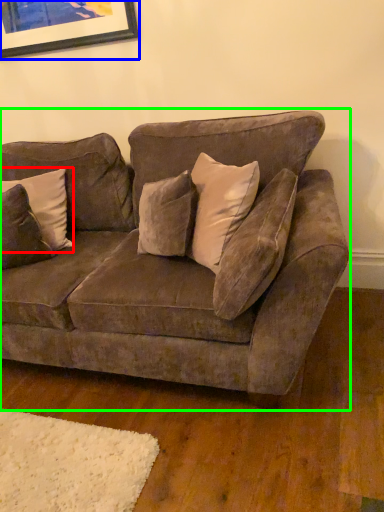
Question: Which object is the farthest from pillow (highlighted by a red box)? Choose among these: picture frame (highlighted by a blue box) or studio couch (highlighted by a green box).

Choices:
 (A) picture frame
 (B) studio couch

Answer: (A)